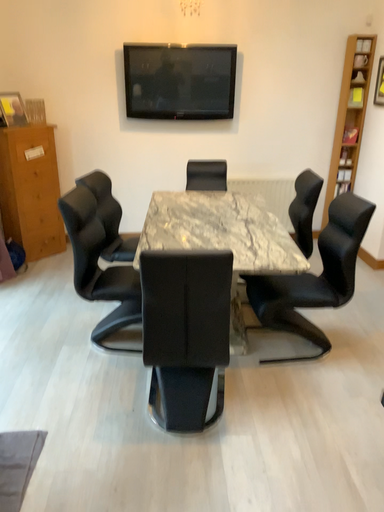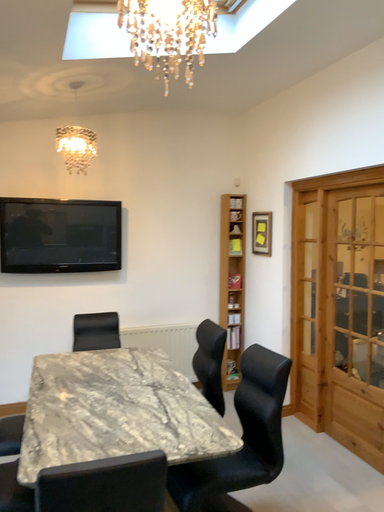
Question: How did the camera likely rotate when shooting the video?

Choices:
 (A) rotated downward
 (B) rotated upward

Answer: (B)